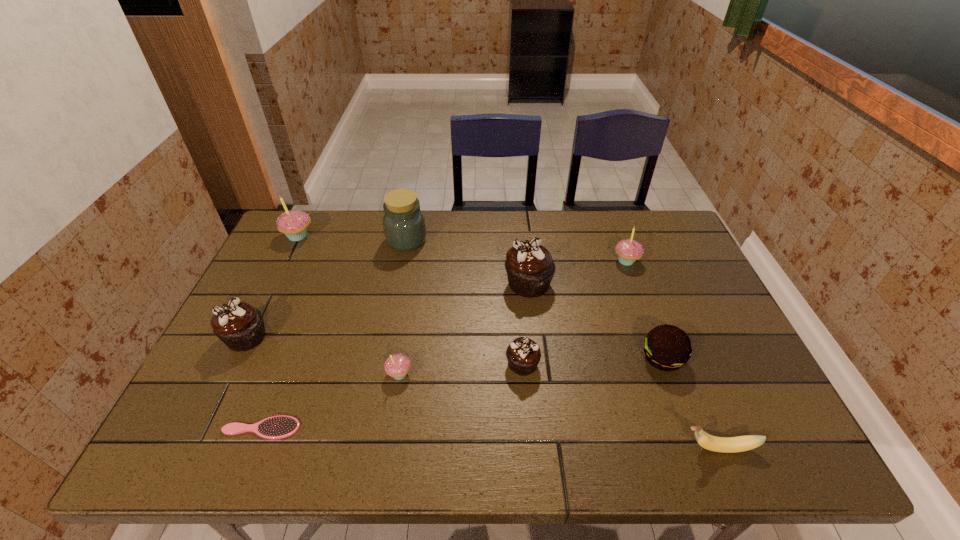
The height and width of the screenshot is (540, 960). In order to click on free point at the near left corner in this screenshot , I will do 205,456.

I want to click on free space at the far right corner, so click(x=636, y=214).

Identify the location of vacant space at the near right corner of the desktop. (730, 457).

Where is `free area in between the green jar and the second nearest object`? The height and width of the screenshot is (540, 960). free area in between the green jar and the second nearest object is located at coordinates (334, 334).

Locate an element on the screen. The image size is (960, 540). empty space between the smallest brown cupcake and the second nearest object is located at coordinates (392, 396).

Locate an element on the screen. This screenshot has width=960, height=540. vacant space in between the biggest pink cupcake and the patty is located at coordinates (480, 297).

Where is `free area in between the green jar and the biggest brown cupcake`? free area in between the green jar and the biggest brown cupcake is located at coordinates (468, 262).

This screenshot has width=960, height=540. Identify the location of free spot between the leftmost pink cupcake and the rightmost pink cupcake. (462, 248).

Locate an element on the screen. free space between the banana and the hairbrush is located at coordinates (490, 438).

This screenshot has height=540, width=960. I want to click on empty space that is in between the smallest brown cupcake and the hairbrush, so click(392, 396).